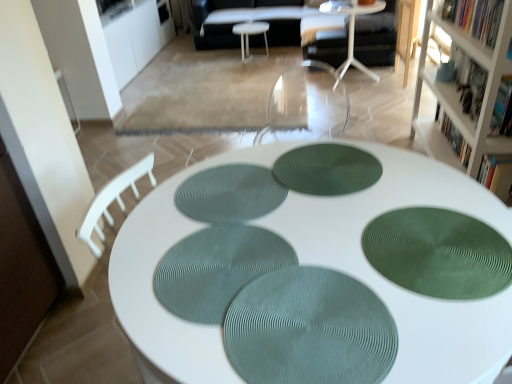
What are the coordinates of `vacant space underneath white plastic table at center, which ranks as the 2th table in front-to-back order (from a real-world perspective)` in the screenshot? It's located at (357, 83).